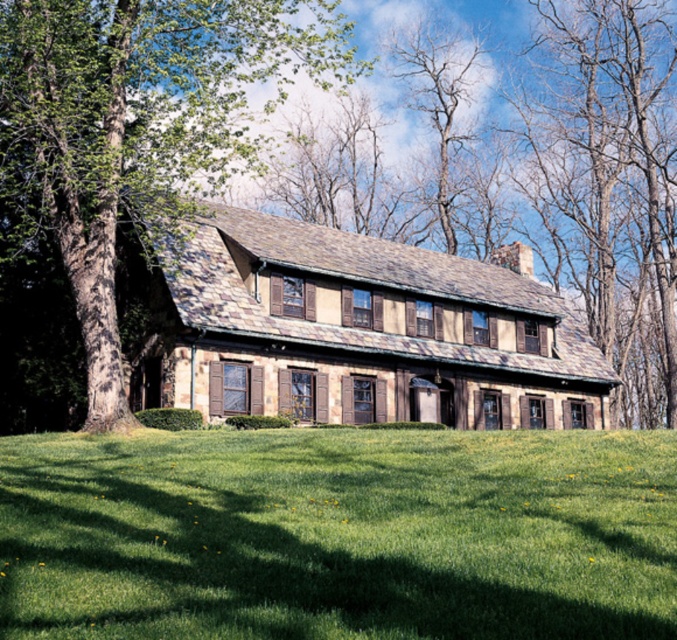
Question: Is green grass at lower center wider than green leafy tree at left?

Choices:
 (A) no
 (B) yes

Answer: (A)

Question: Is green grass at lower center to the right of green leafy tree at left from the viewer's perspective?

Choices:
 (A) yes
 (B) no

Answer: (A)

Question: Is green grass at lower center in front of green leafy tree at left?

Choices:
 (A) yes
 (B) no

Answer: (A)

Question: Among these objects, which one is farthest from the camera?

Choices:
 (A) green leafy tree at left
 (B) green grass at lower center

Answer: (A)

Question: Among these points, which one is nearest to the camera?

Choices:
 (A) (596, 625)
 (B) (0, 65)

Answer: (A)

Question: Among these points, which one is nearest to the camera?

Choices:
 (A) (60, 337)
 (B) (515, 547)

Answer: (B)